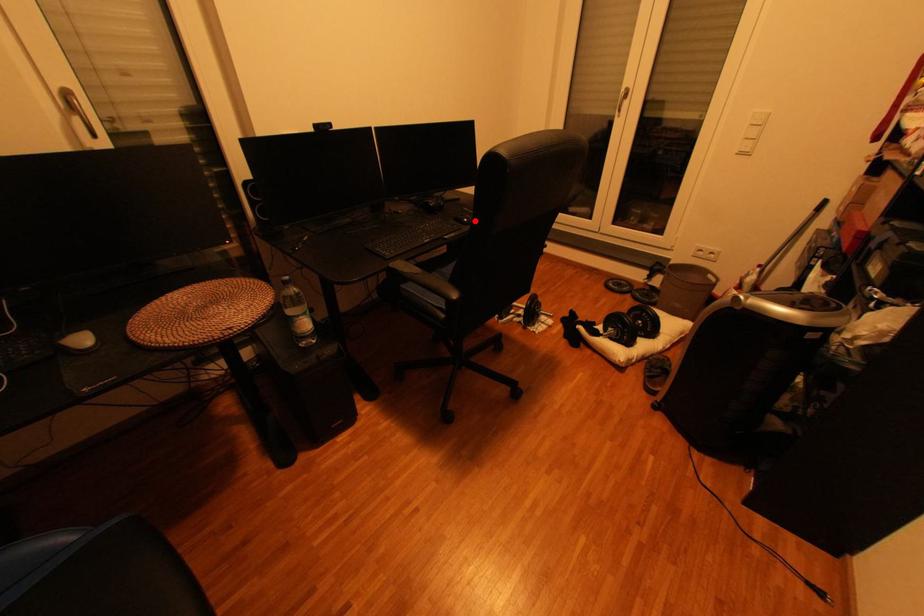
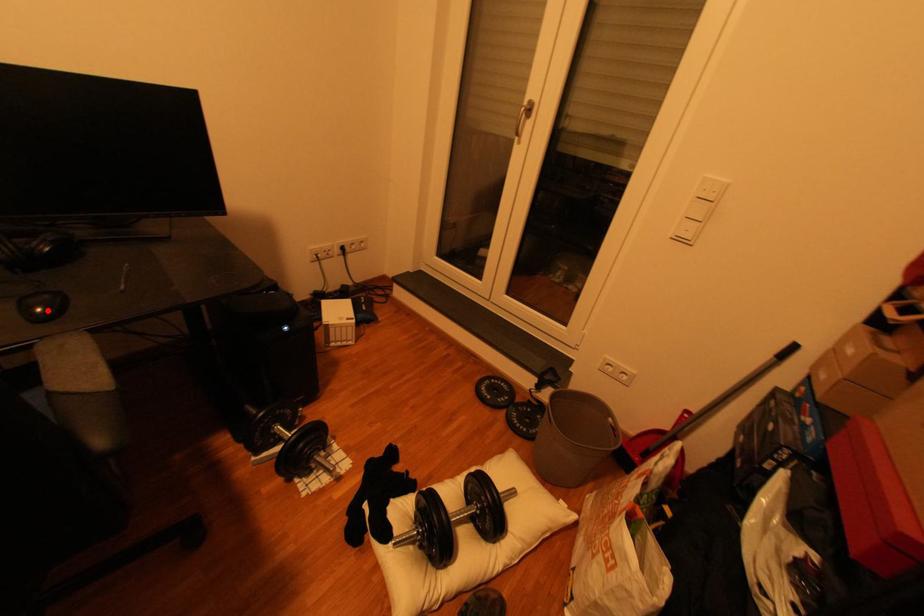
I am providing you with two images of the same scene from different viewpoints. A red point is marked on the first image and another point is marked on the second image. Is the red point in image1 aligned with the point shown in image2?

Yes